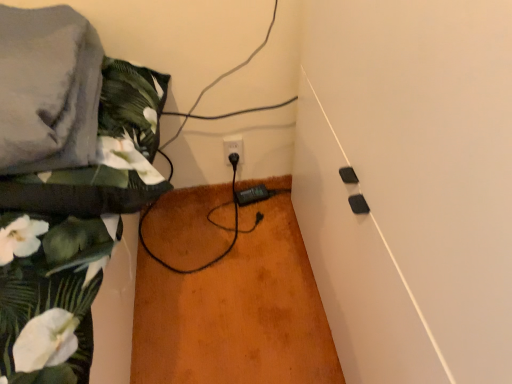
Where is `black plastic socket at center`? This screenshot has height=384, width=512. black plastic socket at center is located at coordinates (233, 147).

Locate an element on the screen. gray fabric at upper left is located at coordinates (48, 89).

This screenshot has height=384, width=512. Describe the element at coordinates (71, 212) in the screenshot. I see `floral fabric at left` at that location.

This screenshot has width=512, height=384. Find the location of `black plastic socket at center`. black plastic socket at center is located at coordinates (233, 147).

Looking at this image, can you confirm if floral fabric at left is bigger than black plastic socket at center?

Yes.

In the scene shown: From a real-world perspective, which object stands above the other?

floral fabric at left, from a real-world perspective.

Is black plastic socket at center at the back of floral fabric at left?

floral fabric at left does not have its back to black plastic socket at center.

From the picture: From a real-world perspective, is black plastic socket at center located higher than gray fabric at upper left?

No, from a real-world perspective, black plastic socket at center is not over gray fabric at upper left

Is black plastic socket at center completely or partially outside of gray fabric at upper left?

Yes, black plastic socket at center is outside of gray fabric at upper left.

From a real-world perspective, is gray fabric at upper left physically located above or below floral fabric at left?

Clearly, from a real-world perspective, gray fabric at upper left is above floral fabric at left.

Identify the location of textile located below the gray fabric at upper left (from the image's perspective). (71, 212).

Is the surface of gray fabric at upper left in direct contact with floral fabric at left?

Yes, gray fabric at upper left is in contact with floral fabric at left.

From the image's perspective, is gray fabric at upper left positioned above or below floral fabric at left?

Based on their image positions, gray fabric at upper left is located above floral fabric at left.

Based on the photo, does black plastic socket at center have a greater height compared to floral fabric at left?

No, black plastic socket at center is not taller than floral fabric at left.

Considering the positions of objects black plastic socket at center and floral fabric at left in the image provided, who is more to the left, black plastic socket at center or floral fabric at left?

From the viewer's perspective, floral fabric at left appears more on the left side.

Could floral fabric at left be considered to be inside black plastic socket at center?

No.

From the picture: From the image's perspective, is black plastic socket at center located above floral fabric at left?

No, from the image's perspective, black plastic socket at center is not on top of floral fabric at left.

From a real-world perspective, is gray fabric at upper left positioned under black plastic socket at center based on gravity?

Incorrect, from a real-world perspective, gray fabric at upper left is higher than black plastic socket at center.

From the image's perspective, which is below, gray fabric at upper left or black plastic socket at center?

black plastic socket at center, from the image's perspective.

Could you tell me if gray fabric at upper left is facing black plastic socket at center?

No.

How distant is gray fabric at upper left from black plastic socket at center?

gray fabric at upper left and black plastic socket at center are 25.83 inches apart.

Is floral fabric at left smaller than gray fabric at upper left?

Actually, floral fabric at left might be larger than gray fabric at upper left.

Where is `linen lying on the left of floral fabric at left`? linen lying on the left of floral fabric at left is located at coordinates (48, 89).

In the scene shown: Is floral fabric at left not near gray fabric at upper left?

floral fabric at left is near gray fabric at upper left, not far away.

From the picture: Would you say floral fabric at left is to the left or to the right of gray fabric at upper left in the picture?

Clearly, floral fabric at left is on the right of gray fabric at upper left in the image.

The height and width of the screenshot is (384, 512). In order to click on power plugs and sockets that is under the floral fabric at left (from a real-world perspective) in this screenshot , I will do `click(233, 147)`.

Find the location of a particular element. This screenshot has width=512, height=384. power plugs and sockets on the right of the gray fabric at upper left is located at coordinates [x=233, y=147].

Looking at the image, which one is located closer to floral fabric at left, gray fabric at upper left or black plastic socket at center?

→ gray fabric at upper left is closer to floral fabric at left.

From the image, which object appears to be nearer to black plastic socket at center, floral fabric at left or gray fabric at upper left?

floral fabric at left.

Considering their positions, is floral fabric at left positioned further to gray fabric at upper left than black plastic socket at center?

Based on the image, black plastic socket at center appears to be further to gray fabric at upper left.

Considering their positions, is black plastic socket at center positioned further to gray fabric at upper left than floral fabric at left?

Based on the image, black plastic socket at center appears to be further to gray fabric at upper left.

Considering their positions, is black plastic socket at center positioned closer to floral fabric at left than gray fabric at upper left?

Among the two, gray fabric at upper left is located nearer to floral fabric at left.

From the image, which object appears to be nearer to black plastic socket at center, gray fabric at upper left or floral fabric at left?

floral fabric at left is positioned closer to the anchor black plastic socket at center.

I want to click on textile between gray fabric at upper left and black plastic socket at center in the front-back direction, so click(x=71, y=212).